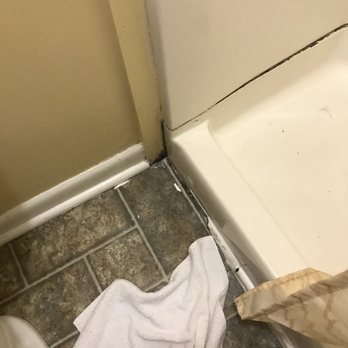
Locate an element on the screen. light brown painted wall is located at coordinates coord(68,79).